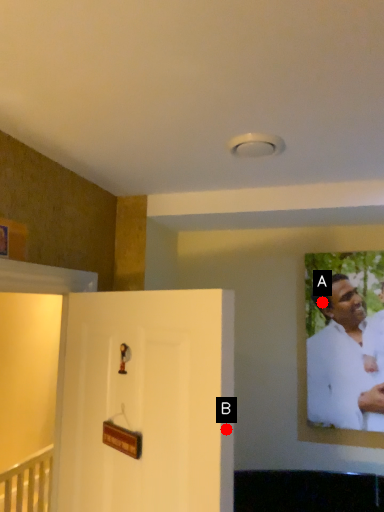
Question: Two points are circled on the image, labeled by A and B beside each circle. Which point is farther from the camera taking this photo?

Choices:
 (A) A is further
 (B) B is further

Answer: (A)